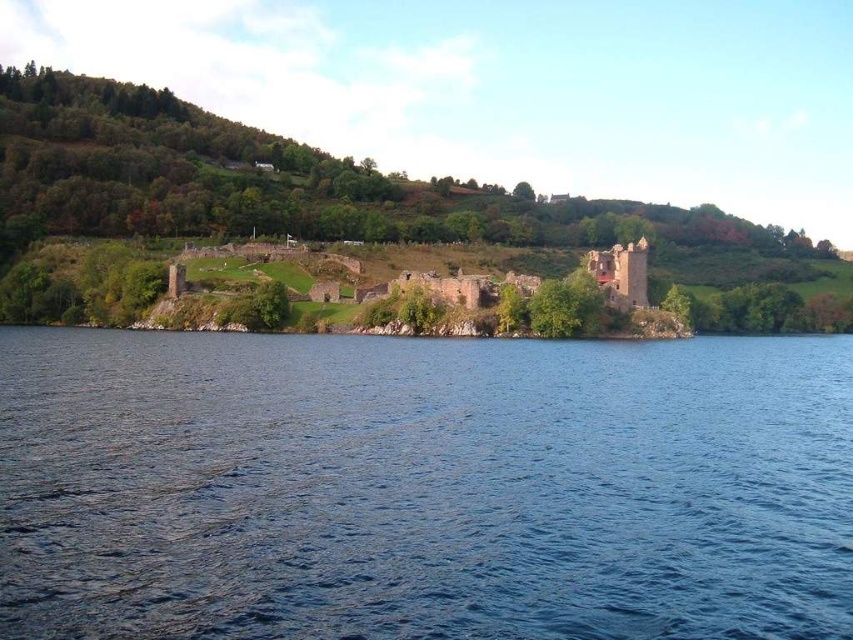
Question: Which of the following is the farthest from the observer?

Choices:
 (A) click(315, 353)
 (B) click(634, 307)

Answer: (B)

Question: Does green grassy hillside at upper center have a lesser width compared to rustic stone castle at center?

Choices:
 (A) no
 (B) yes

Answer: (A)

Question: Which point is closer to the camera taking this photo?

Choices:
 (A) (57, 84)
 (B) (618, 288)

Answer: (B)

Question: Does blue water at center have a lesser width compared to green grassy hillside at upper center?

Choices:
 (A) yes
 (B) no

Answer: (A)

Question: Which object appears farthest from the camera in this image?

Choices:
 (A) blue water at center
 (B) rustic stone castle at center

Answer: (B)

Question: From the image, what is the correct spatial relationship of blue water at center in relation to green grassy hillside at upper center?

Choices:
 (A) below
 (B) above

Answer: (A)